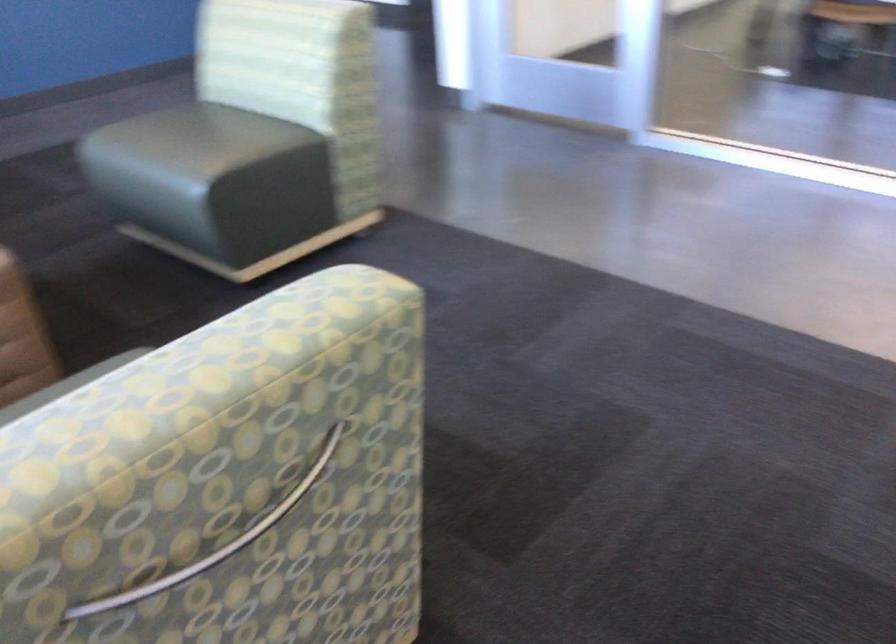
This screenshot has height=644, width=896. I want to click on silver chair handle, so click(x=216, y=542).